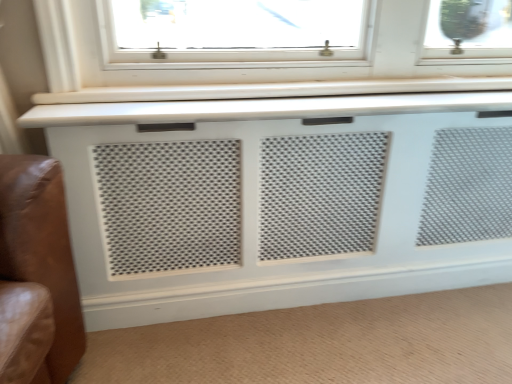
Describe the element at coordinates (281, 201) in the screenshot. Image resolution: width=512 pixels, height=384 pixels. I see `white perforated grille at center` at that location.

The image size is (512, 384). What are the coordinates of `white perforated grille at center` in the screenshot? It's located at (281, 201).

The image size is (512, 384). What do you see at coordinates (320, 344) in the screenshot? I see `white perforated panel at lower center` at bounding box center [320, 344].

Locate an element on the screen. white perforated panel at lower center is located at coordinates (320, 344).

Locate an element on the screen. white perforated grille at center is located at coordinates (281, 201).

Can you confirm if white perforated panel at lower center is positioned to the right of white perforated grille at center?

No.

Considering their positions, is white perforated panel at lower center located in front of or behind white perforated grille at center?

white perforated panel at lower center is positioned closer to the viewer than white perforated grille at center.

Is point (114, 332) more distant than point (300, 286)?

That is False.

From the image's perspective, would you say white perforated panel at lower center is shown under white perforated grille at center?

Yes, from the image's perspective, white perforated panel at lower center is beneath white perforated grille at center.

Based on the photo, from a real-world perspective, which is physically above, white perforated panel at lower center or white perforated grille at center?

white perforated grille at center, from a real-world perspective.

Which of these two, white perforated panel at lower center or white perforated grille at center, is wider?

With larger width is white perforated panel at lower center.

Considering the relative sizes of white perforated panel at lower center and white perforated grille at center in the image provided, is white perforated panel at lower center taller than white perforated grille at center?

No, white perforated panel at lower center is not taller than white perforated grille at center.

Between white perforated panel at lower center and white perforated grille at center, which one has smaller size?

With smaller size is white perforated panel at lower center.

Is white perforated panel at lower center completely or partially outside of white perforated grille at center?

Absolutely, white perforated panel at lower center is external to white perforated grille at center.

Is white perforated panel at lower center placed right next to white perforated grille at center?

white perforated panel at lower center and white perforated grille at center are not in contact.

Is white perforated panel at lower center facing away from white perforated grille at center?

white perforated panel at lower center is not turned away from white perforated grille at center.

Where is `plain in front of the white perforated grille at center`? plain in front of the white perforated grille at center is located at coordinates (320, 344).

From the picture: Considering the positions of objects white perforated grille at center and white perforated panel at lower center in the image provided, who is more to the left, white perforated grille at center or white perforated panel at lower center?

Positioned to the left is white perforated panel at lower center.

Between white perforated grille at center and white perforated panel at lower center, which one is positioned in front?

white perforated panel at lower center.

Does point (420, 186) lie in front of point (152, 367)?

No.

From the image's perspective, is white perforated grille at center positioned above or below white perforated panel at lower center?

From the image's perspective, white perforated grille at center appears above white perforated panel at lower center.

From a real-world perspective, which object stands above the other?

white perforated grille at center.

Which object is thinner, white perforated grille at center or white perforated panel at lower center?

white perforated grille at center is thinner.

Consider the image. Who is taller, white perforated grille at center or white perforated panel at lower center?

white perforated grille at center.

Does white perforated grille at center have a larger size compared to white perforated panel at lower center?

Indeed, white perforated grille at center has a larger size compared to white perforated panel at lower center.

Do you think white perforated grille at center is within white perforated panel at lower center, or outside of it?

white perforated grille at center cannot be found inside white perforated panel at lower center.

Is white perforated grille at center touching white perforated panel at lower center?

No, white perforated grille at center is not making contact with white perforated panel at lower center.

Is white perforated panel at lower center at the back of white perforated grille at center?

white perforated grille at center does not have its back to white perforated panel at lower center.

Where is `plain beneath the white perforated grille at center (from a real-world perspective)`? plain beneath the white perforated grille at center (from a real-world perspective) is located at coordinates (320, 344).

Locate an element on the screen. The width and height of the screenshot is (512, 384). plain on the left of white perforated grille at center is located at coordinates (320, 344).

This screenshot has height=384, width=512. What are the coordinates of `plain below the white perforated grille at center (from a real-world perspective)` in the screenshot? It's located at (320, 344).